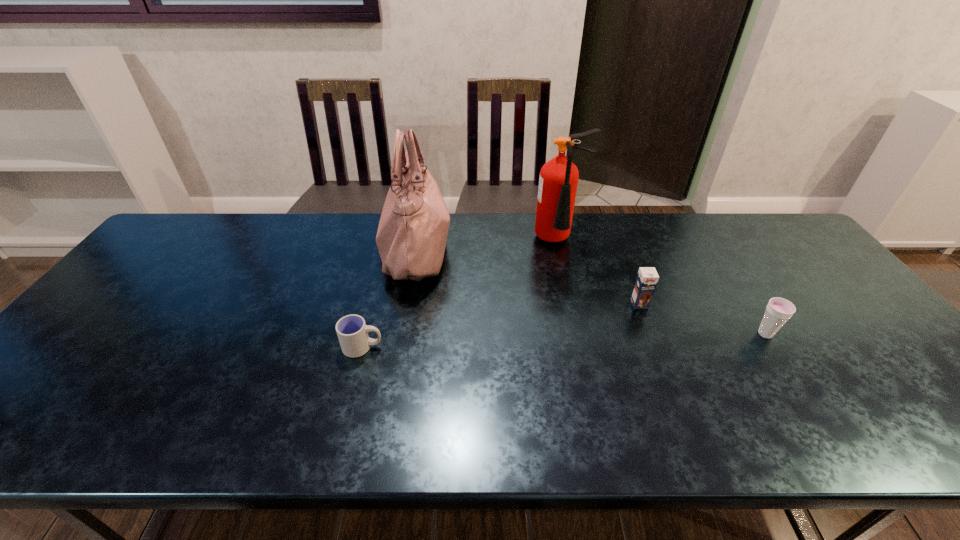
Find the location of `handbag`. handbag is located at coordinates (411, 238).

The image size is (960, 540). Identify the location of fire extinguisher. (558, 181).

Where is `chocolate milk`? The image size is (960, 540). chocolate milk is located at coordinates (647, 277).

Where is `the second object from right to left`? The image size is (960, 540). the second object from right to left is located at coordinates (647, 277).

This screenshot has height=540, width=960. I want to click on the taller cup, so click(x=778, y=311).

I want to click on the second shortest object, so click(778, 311).

Locate an element on the screen. This screenshot has width=960, height=540. the left cup is located at coordinates (352, 332).

Where is `the shorter cup`? Image resolution: width=960 pixels, height=540 pixels. the shorter cup is located at coordinates (352, 332).

The height and width of the screenshot is (540, 960). I want to click on vacant region located 0.110m at the front of the handbag with handles, so click(x=487, y=249).

At what (x,y) coordinates should I click in order to perform the action: click on free spot located 0.050m at the nozzle of the fire extinguisher. Please return your answer as a coordinate pair (x, y). This screenshot has height=540, width=960. Looking at the image, I should click on (564, 268).